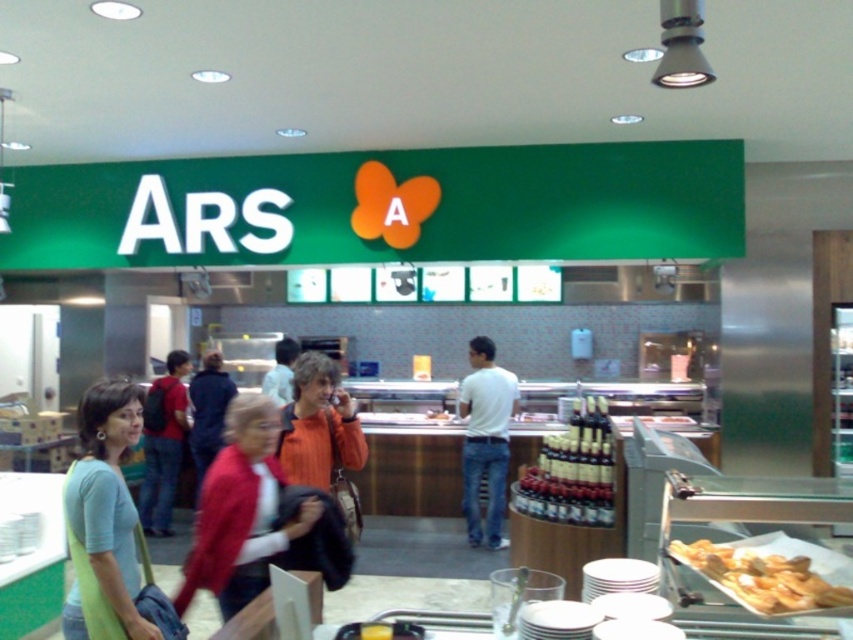
Question: Which point is farther to the camera?

Choices:
 (A) shiny glass bottles at center
 (B) white matte shirt at center
 (C) light blue fabric shirt at center
 (D) jeans at center

Answer: (D)

Question: Among these points, which one is nearest to the camera?

Choices:
 (A) (442, 412)
 (B) (244, 573)
 (C) (129, 419)

Answer: (C)

Question: Is red sweater at center thinner than jeans at center?

Choices:
 (A) no
 (B) yes

Answer: (A)

Question: Can you confirm if golden crispy pastry at lower right is positioned to the right of jeans at center?

Choices:
 (A) yes
 (B) no

Answer: (A)

Question: Is light blue fabric shirt at center above golden crispy pastry at lower right?

Choices:
 (A) yes
 (B) no

Answer: (B)

Question: Among these objects, which one is nearest to the camera?

Choices:
 (A) light blue fabric shirt at center
 (B) translucent glass bottle at center
 (C) golden crispy pastry at lower right
 (D) red sweater at center

Answer: (C)